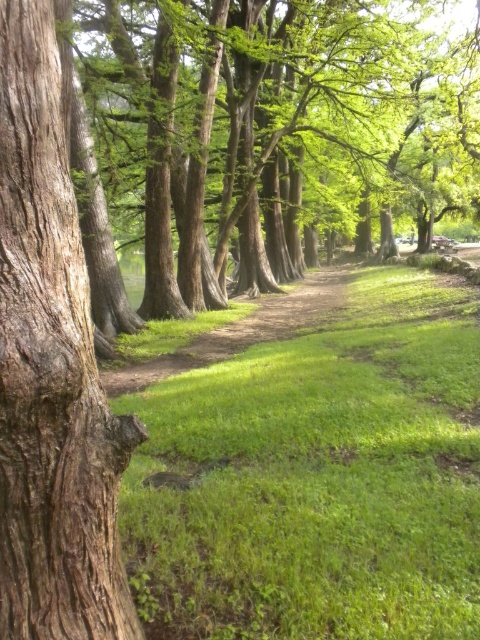
Based on the photo, between green grassy at center and green rough bark tree at center, which one appears on the right side from the viewer's perspective?

From the viewer's perspective, green rough bark tree at center appears more on the right side.

This screenshot has width=480, height=640. Find the location of `green grassy at center`. green grassy at center is located at coordinates (316, 477).

At what (x,y) coordinates should I click in order to perform the action: click on green grassy at center. Please return your answer as a coordinate pair (x, y). Looking at the image, I should click on (316, 477).

You are a GUI agent. You are given a task and a screenshot of the screen. Output one action in this format:
    pyautogui.click(x=<x>, y=<y>)
    Task: Click on the green grassy at center
    
    Given the screenshot: What is the action you would take?
    pyautogui.click(x=316, y=477)

Looking at this image, does green rough bark tree at center come in front of dirt path at center?

Yes, it is.

Does point (91, 208) come farther from viewer compared to point (288, 320)?

No.

This screenshot has height=640, width=480. Identify the location of green rough bark tree at center. coord(264,138).

Locate an element on the screen. The height and width of the screenshot is (640, 480). green rough bark tree at center is located at coordinates (264, 138).

Looking at this image, is brown rough bark tree trunk at left closer to camera compared to dirt path at center?

Yes, it is in front of dirt path at center.

Which is behind, point (82, 572) or point (310, 316)?

The point (310, 316) is more distant.

Where is `brown rough bark tree trunk at left`? Image resolution: width=480 pixels, height=640 pixels. brown rough bark tree trunk at left is located at coordinates (50, 369).